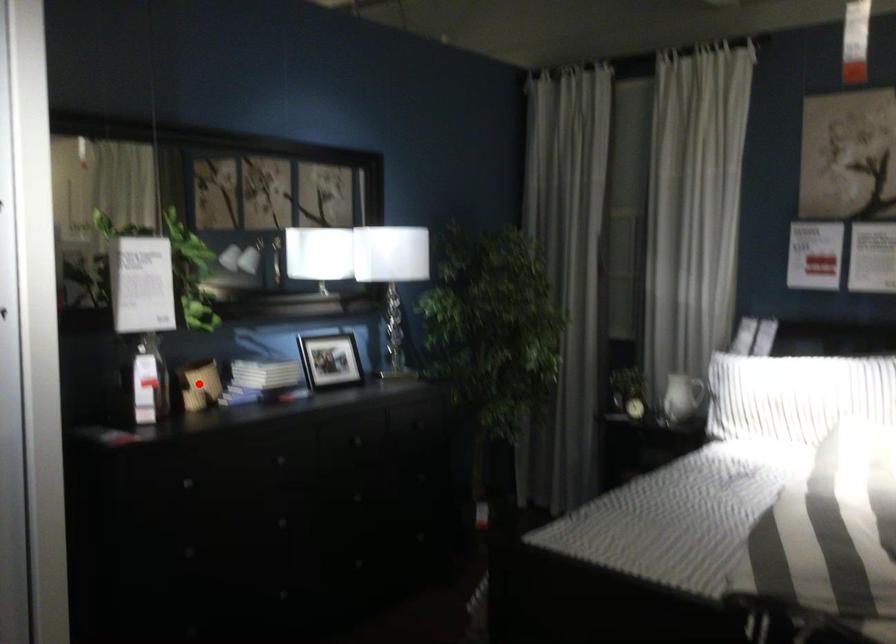
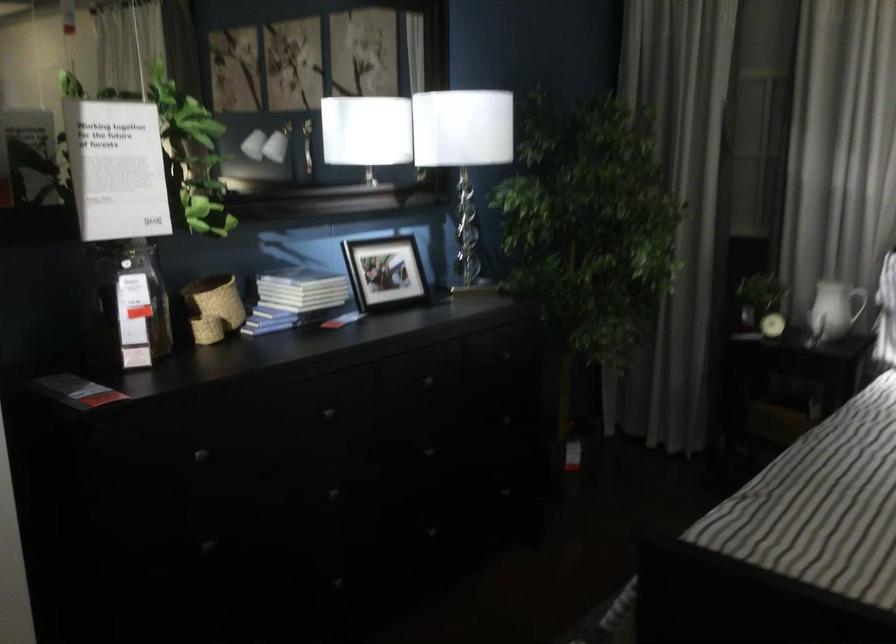
Question: I am providing you with two images of the same scene from different viewpoints. In image1, a red point is highlighted. Considering the same 3D point in image2, which of the following is correct?

Choices:
 (A) It is closer
 (B) It is farther

Answer: (A)